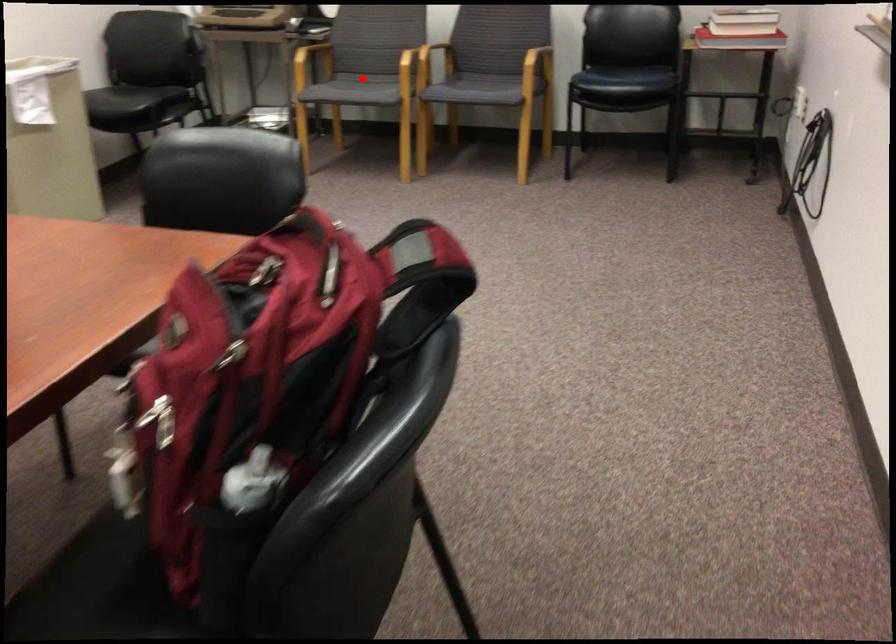
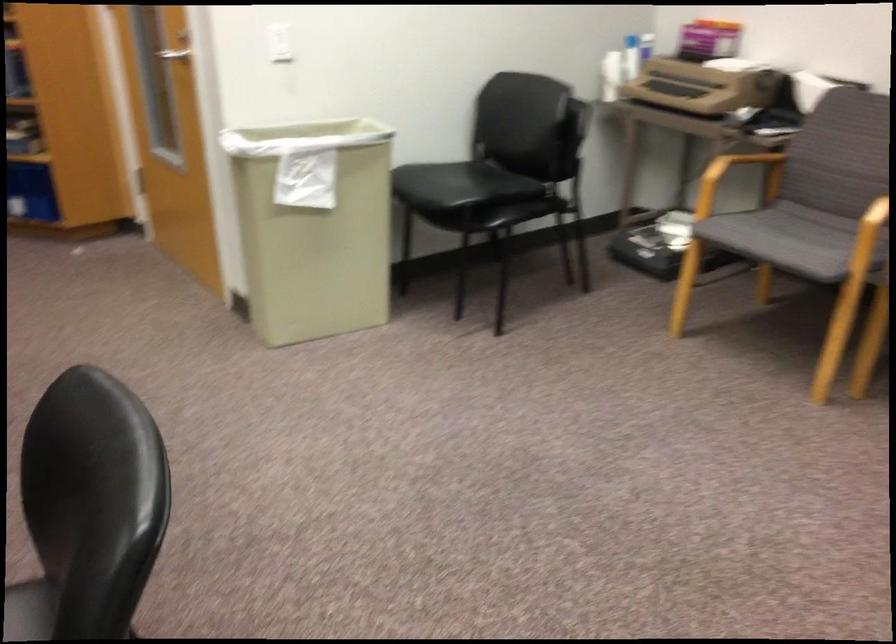
Find the pixel in the second image that matches the highlighted location in the first image.

(789, 243)